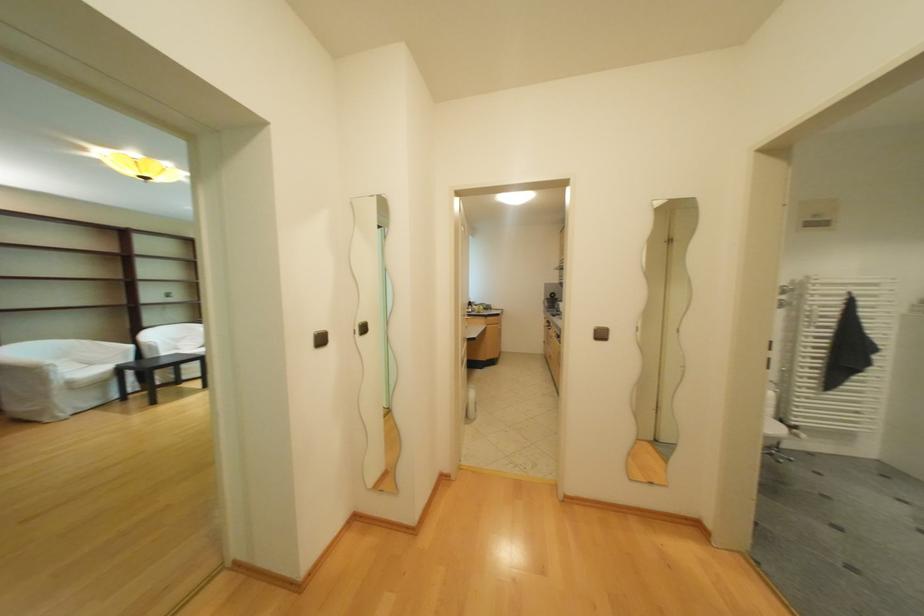
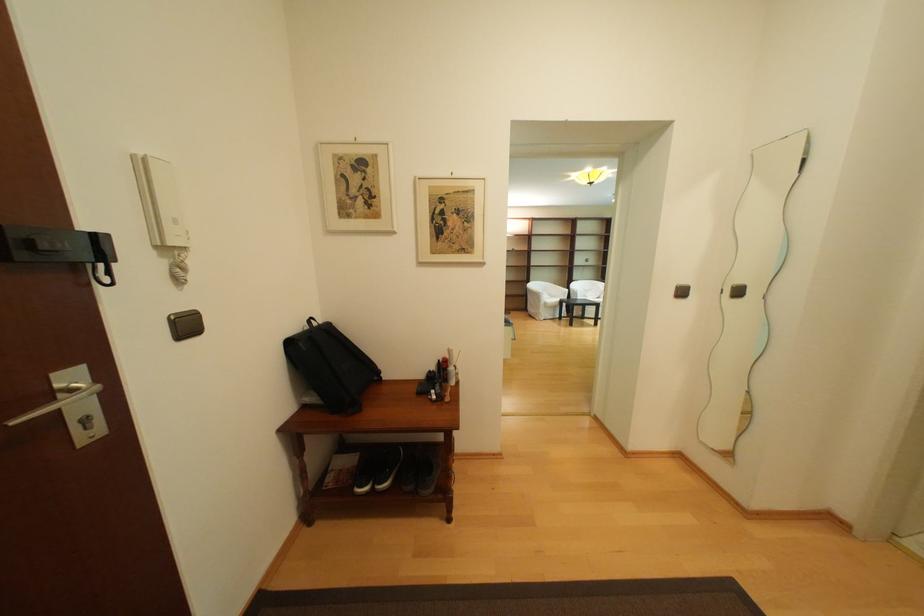
Question: The camera is either moving clockwise (left) or counter-clockwise (right) around the object. The first image is from the beginning of the video and the second image is from the end. Is the camera moving left or right when shooting the video?

Choices:
 (A) Left
 (B) Right

Answer: (B)